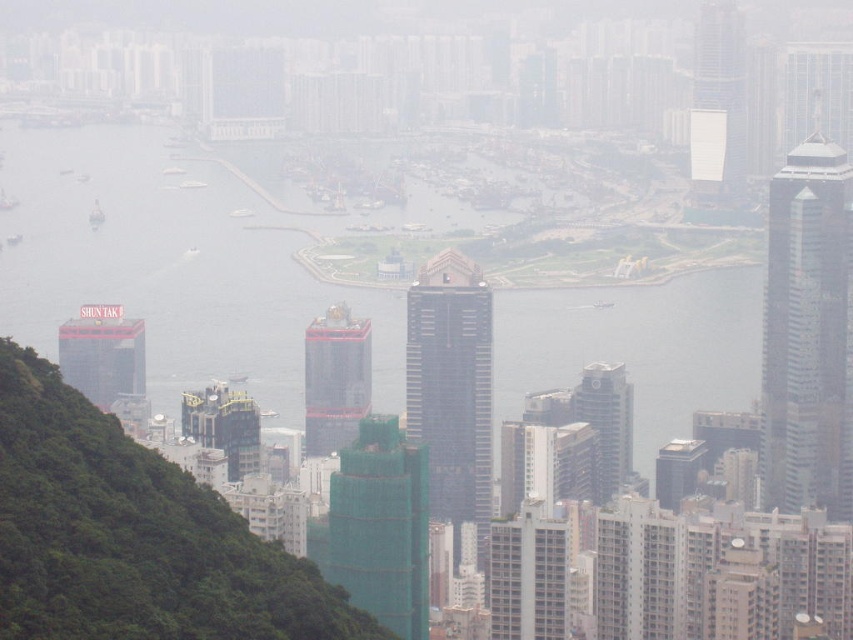
You are standing at the base of the green hillside in the foreground of the city panorama. You see two points marked in the scene. Which point is closer to you, point at coordinates [367,554] or point at coordinates [708,12]?

Point at coordinates [367,554] is closer to you than point at coordinates [708,12].

You are standing at a viewpoint overlooking the city. You see the green textured hillside at left and the glassy silver skyscraper at right. Which of these two landmarks is positioned more to the east if the city is oriented such that the river flows north to south?

The green textured hillside at left is positioned to the left of the glassy silver skyscraper at right. Since the river flows north to south, the left side of the city would be the eastern part. Therefore, the green textured hillside at left is more to the east.

Based on the scene, which object is shorter between the green textured hillside at left and the glassy silver skyscraper at right?

The green textured hillside at left is shorter than the glassy silver skyscraper at right.